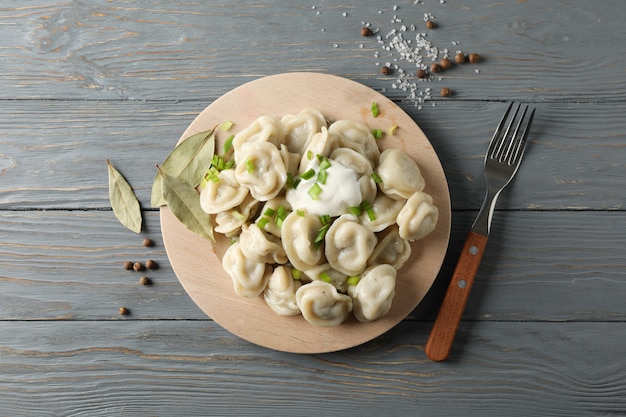
The image size is (626, 417). I want to click on fork, so [x=498, y=154].